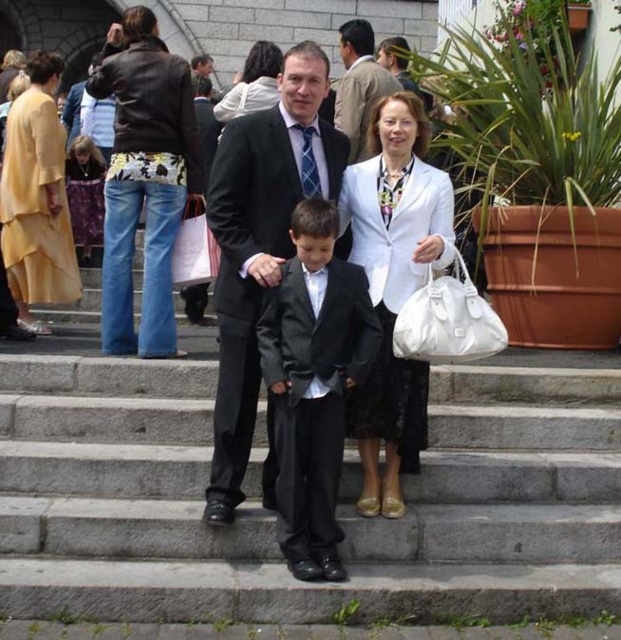
From the picture: You are a photographer trying to capture a wide shot of the scene. The gray concrete stairs at center and the shiny black suit at center are both in your frame. Considering their sizes, which object will occupy more space in the photo?

The gray concrete stairs at center will occupy more space in the photo because its width is larger than that of the shiny black suit at center.

You are a photographer trying to capture a closeup of the gray concrete stairs at center and the white leather handbag at center. Given their sizes, which object would require you to step back more to fit into the frame?

The gray concrete stairs at center is wider than the white leather handbag at center, so you would need to step back more to capture the gray concrete stairs at center in the frame.